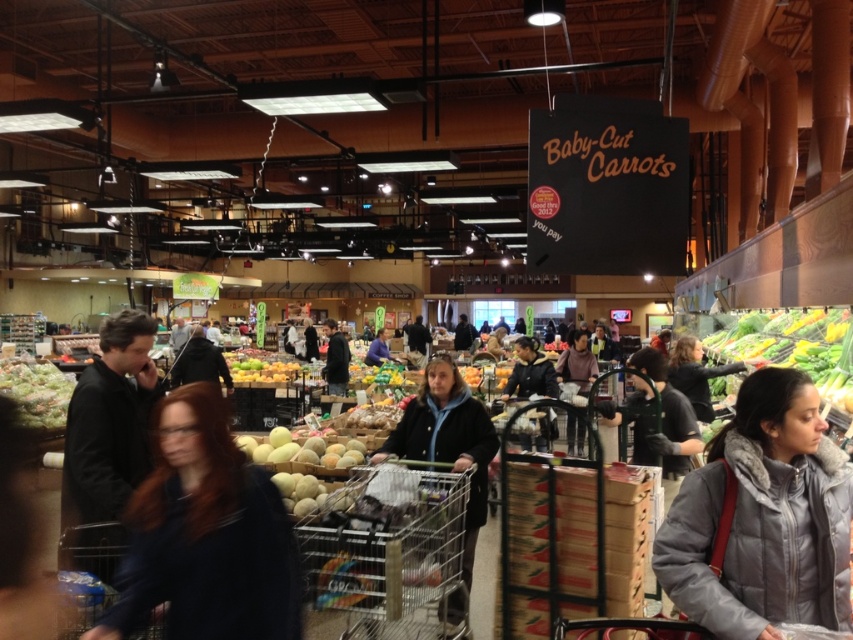
Question: Which object is positioned closest to the metallic silver shopping cart at center?

Choices:
 (A) dark gray sweater at center
 (B) green leafy vegetables at center

Answer: (A)

Question: Which of these objects is positioned closest to the dark blue jacket at center?

Choices:
 (A) dark blue sweater at center
 (B) metallic silver shopping cart at center

Answer: (B)

Question: Does dark gray jacket at left appear under dark gray sweater at center?

Choices:
 (A) no
 (B) yes

Answer: (A)

Question: Which point is closer to the camera?

Choices:
 (A) gray puffer jacket at lower right
 (B) dark gray jacket at left
 (C) dark gray hoodie at center
 (D) dark gray sweater at center

Answer: (A)

Question: Is dark gray sweater at center smaller than dark gray hoodie at center?

Choices:
 (A) yes
 (B) no

Answer: (B)

Question: Does dark gray jacket at left appear on the left side of green leafy vegetables at center?

Choices:
 (A) no
 (B) yes

Answer: (B)